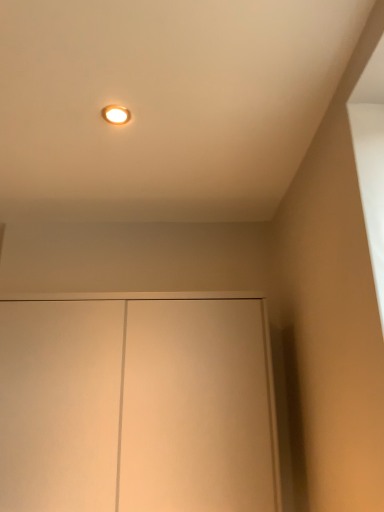
The width and height of the screenshot is (384, 512). What do you see at coordinates (136, 406) in the screenshot?
I see `white matte door at center` at bounding box center [136, 406].

Where is `white matte door at center`? This screenshot has height=512, width=384. white matte door at center is located at coordinates (136, 406).

Find the location of a particular element. The image size is (384, 512). white matte door at center is located at coordinates (136, 406).